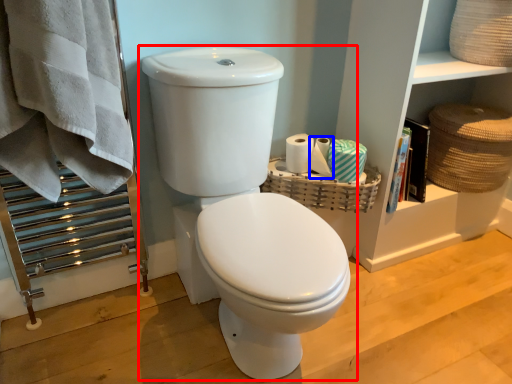
Question: Which object appears farthest to the camera in this image, toilet (highlighted by a red box) or toilet paper (highlighted by a blue box)?

Choices:
 (A) toilet
 (B) toilet paper

Answer: (B)